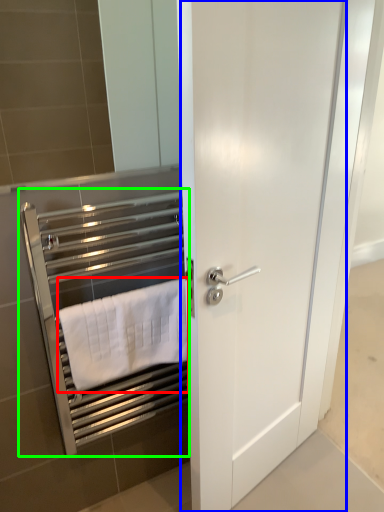
Question: Which object is the closest to the towel (highlighted by a red box)? Choose among these: door (highlighted by a blue box) or closet (highlighted by a green box).

Choices:
 (A) door
 (B) closet

Answer: (B)